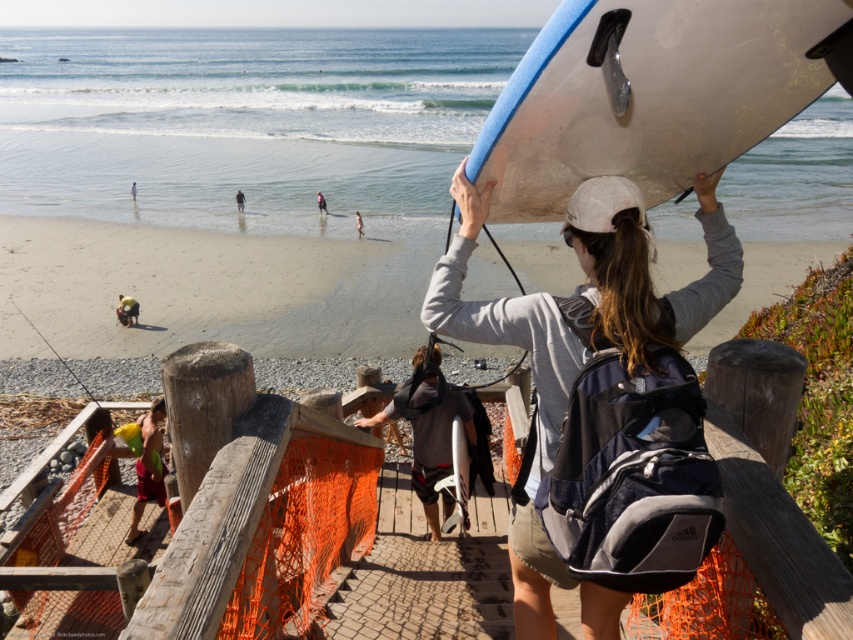
Consider the image. You are standing at the wooden ramp where the person with the surfboard is walking. Looking towards the ocean, you see a point marked at coordinates (206, 289). What is located at that point?

The point at coordinates (206, 289) indicates smooth sand beach at center.

Based on the photo, you are a photographer trying to capture the person with the surfboard on the beach. To get a clear shot of both the matte gray surfboard at upper center and the smooth sand beach at center, which object should you focus on first?

The smooth sand beach at center is positioned over the matte gray surfboard at upper center, so you should focus on the smooth sand beach at center first to ensure both are in frame.